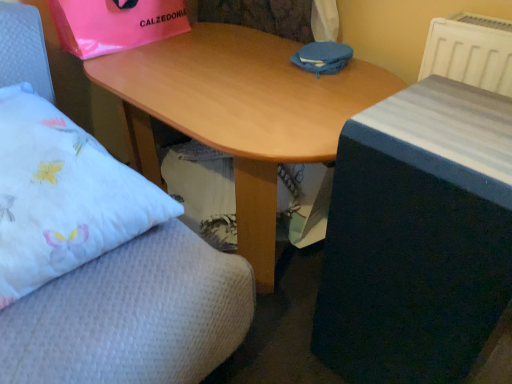
In the scene shown: What is the approximate height of white plastic radiator at upper right?

white plastic radiator at upper right is 8.12 inches in height.

In order to face white plastic radiator at upper right, should I rotate leftwards or rightwards?

You should look right and rotate roughly 27.602 degrees.

What do you see at coordinates (115, 24) in the screenshot? The image size is (512, 384). I see `pink plastic bag at upper left` at bounding box center [115, 24].

Locate an element on the screen. The width and height of the screenshot is (512, 384). white fabric pillow at left is located at coordinates (62, 195).

Where is `white plastic radiator at upper right`? Image resolution: width=512 pixels, height=384 pixels. white plastic radiator at upper right is located at coordinates (470, 51).

Is white fabric pillow at left at the left side of white plastic radiator at upper right?

Indeed, white fabric pillow at left is positioned on the left side of white plastic radiator at upper right.

At what (x,y) coordinates should I click in order to perform the action: click on radiator above the white fabric pillow at left (from a real-world perspective). Please return your answer as a coordinate pair (x, y). Looking at the image, I should click on (470, 51).

Considering the sizes of objects white fabric pillow at left and white plastic radiator at upper right in the image provided, who is thinner, white fabric pillow at left or white plastic radiator at upper right?

white plastic radiator at upper right.

There is a wooden desk at center. Where is `pillow above it (from a real-world perspective)`? The image size is (512, 384). pillow above it (from a real-world perspective) is located at coordinates (62, 195).

Is white fabric pillow at left next to wooden desk at center?

They are not placed beside each other.

Considering the sizes of objects white fabric pillow at left and wooden desk at center in the image provided, who is bigger, white fabric pillow at left or wooden desk at center?

wooden desk at center is bigger.

From a real-world perspective, which object stands above the other?

From a 3D spatial view, white fabric pillow at left is above.

Does point (387, 145) lie in front of point (116, 28)?

Yes, it is.

Does wooden table at center come behind pink plastic bag at upper left?

No, wooden table at center is in front of pink plastic bag at upper left.

Who is taller, wooden table at center or pink plastic bag at upper left?

wooden table at center is taller.

Is white plastic radiator at upper right a part of wooden desk at center?

No, wooden desk at center does not contain white plastic radiator at upper right.

Considering the relative sizes of wooden desk at center and white plastic radiator at upper right in the image provided, is wooden desk at center wider than white plastic radiator at upper right?

Correct, the width of wooden desk at center exceeds that of white plastic radiator at upper right.

You are a GUI agent. You are given a task and a screenshot of the screen. Output one action in this format:
    pyautogui.click(x=<x>, y=<y>)
    Task: Click on the radiator on the right side of wooden desk at center
    
    Given the screenshot: What is the action you would take?
    pyautogui.click(x=470, y=51)

Does wooden desk at center turn towards white plastic radiator at upper right?

No, wooden desk at center is not facing towards white plastic radiator at upper right.

Can you tell me how much wooden desk at center and pink plastic bag at upper left differ in facing direction?

They differ by 88.9 degrees in their facing directions.

Would you consider wooden desk at center to be distant from pink plastic bag at upper left?

They are positioned close to each other.

Does wooden desk at center turn towards pink plastic bag at upper left?

No, wooden desk at center is not oriented towards pink plastic bag at upper left.

Between wooden desk at center and pink plastic bag at upper left, which one has more height?

wooden desk at center is taller.

Which object is closer to the camera, wooden desk at center or white fabric pillow at left?

white fabric pillow at left.

Is wooden desk at center looking in the opposite direction of white fabric pillow at left?

No, white fabric pillow at left is not at the back of wooden desk at center.

From a real-world perspective, who is located higher, wooden desk at center or white fabric pillow at left?

In real-world perspective, white fabric pillow at left is above.

Who is shorter, wooden desk at center or white fabric pillow at left?

Standing shorter between the two is white fabric pillow at left.

Where is `desk lying below the white plastic radiator at upper right (from the image's perspective)`? This screenshot has width=512, height=384. desk lying below the white plastic radiator at upper right (from the image's perspective) is located at coordinates (238, 113).

Does white plastic radiator at upper right have a lesser width compared to wooden desk at center?

Yes, white plastic radiator at upper right is thinner than wooden desk at center.

Based on the photo, could you tell me if white plastic radiator at upper right is facing wooden desk at center?

No, white plastic radiator at upper right does not turn towards wooden desk at center.

Considering the relative positions of white plastic radiator at upper right and wooden desk at center in the image provided, is white plastic radiator at upper right to the left or to the right of wooden desk at center?

white plastic radiator at upper right is to the right of wooden desk at center.

In order to click on pillow on the left side of white plastic radiator at upper right in this screenshot , I will do `click(62, 195)`.

Identify the location of desk that is behind the white fabric pillow at left. (238, 113).

In the scene shown: Estimate the real-world distances between objects in this image. Which object is closer to white fabric pillow at left, white plastic radiator at upper right or wooden table at center?

wooden table at center is closer to white fabric pillow at left.

Estimate the real-world distances between objects in this image. Which object is closer to wooden desk at center, white fabric pillow at left or white plastic radiator at upper right?

white fabric pillow at left.

From the image, which object appears to be farther from white fabric pillow at left, wooden desk at center or wooden table at center?

wooden table at center.

Looking at the image, which one is located further to pink plastic bag at upper left, white plastic radiator at upper right or wooden desk at center?

Based on the image, white plastic radiator at upper right appears to be further to pink plastic bag at upper left.

Consider the image. Estimate the real-world distances between objects in this image. Which object is closer to wooden table at center, pink plastic bag at upper left or white fabric pillow at left?

The object closer to wooden table at center is white fabric pillow at left.

From the picture: Based on their spatial positions, is white plastic radiator at upper right or pink plastic bag at upper left closer to white fabric pillow at left?

pink plastic bag at upper left is positioned closer to the anchor white fabric pillow at left.

Looking at the image, which one is located closer to white plastic radiator at upper right, wooden table at center or white fabric pillow at left?

Among the two, wooden table at center is located nearer to white plastic radiator at upper right.

From the picture: From the image, which object appears to be farther from white fabric pillow at left, wooden desk at center or white plastic radiator at upper right?

The object further to white fabric pillow at left is white plastic radiator at upper right.

Where is `table situated between white fabric pillow at left and white plastic radiator at upper right from left to right`? Image resolution: width=512 pixels, height=384 pixels. table situated between white fabric pillow at left and white plastic radiator at upper right from left to right is located at coordinates (417, 236).

You are a GUI agent. You are given a task and a screenshot of the screen. Output one action in this format:
    pyautogui.click(x=<x>, y=<y>)
    Task: Click on the table situated between wooden desk at center and white plastic radiator at upper right from left to right
    The height and width of the screenshot is (384, 512).
    Given the screenshot: What is the action you would take?
    pyautogui.click(x=417, y=236)

At what (x,y) coordinates should I click in order to perform the action: click on paper bag located between white fabric pillow at left and wooden table at center in the left-right direction. Please return your answer as a coordinate pair (x, y). Looking at the image, I should click on (115, 24).

Where is `desk situated between pink plastic bag at upper left and white plastic radiator at upper right from left to right`? desk situated between pink plastic bag at upper left and white plastic radiator at upper right from left to right is located at coordinates (238, 113).